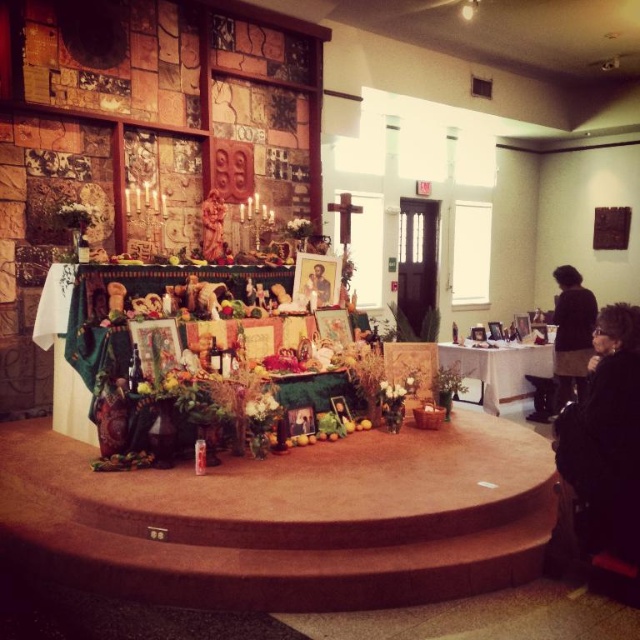
Question: Can you confirm if black fuzzy coat at lower right is wider than white cloth-covered table at center?

Choices:
 (A) yes
 (B) no

Answer: (B)

Question: Which object is positioned farthest from the white cloth-covered table at center?

Choices:
 (A) wooden statue at center
 (B) black fuzzy coat at lower right
 (C) black skirt at right

Answer: (A)

Question: Can you confirm if black fuzzy coat at lower right is smaller than wooden statue at center?

Choices:
 (A) no
 (B) yes

Answer: (A)

Question: Is black fuzzy coat at lower right above black skirt at right?

Choices:
 (A) no
 (B) yes

Answer: (A)

Question: Which is nearer to the black skirt at right?

Choices:
 (A) matte black portrait at center
 (B) black fuzzy coat at lower right
 (C) white cloth-covered table at center

Answer: (C)

Question: Which object is positioned farthest from the wooden statue at center?

Choices:
 (A) black skirt at right
 (B) white cloth-covered table at center
 (C) black fuzzy coat at lower right
 (D) matte black portrait at center

Answer: (A)